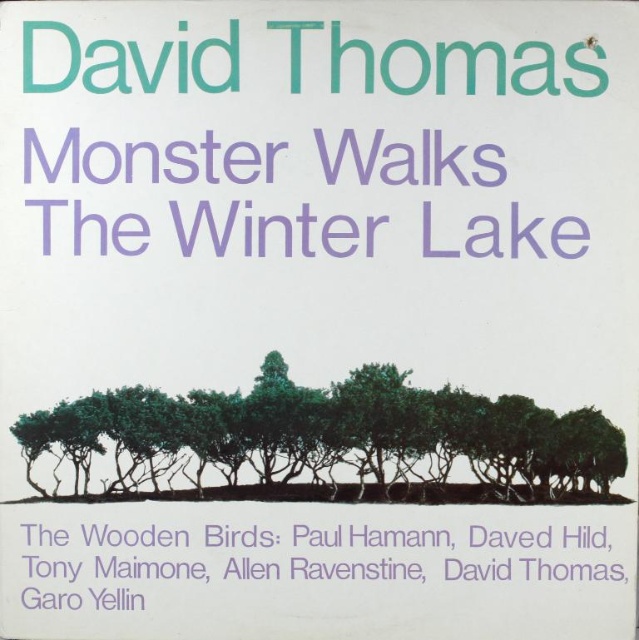
Question: In this image, where is purple paper text at upper center located relative to purple paper at bottom?

Choices:
 (A) right
 (B) left

Answer: (B)

Question: Does green matte trees at center appear over purple paper at bottom?

Choices:
 (A) no
 (B) yes

Answer: (B)

Question: Does green matte trees at center come behind purple paper text at upper center?

Choices:
 (A) no
 (B) yes

Answer: (B)

Question: Which point is farther to the camera?

Choices:
 (A) (88, 540)
 (B) (93, 486)

Answer: (B)

Question: Which object appears closest to the camera in this image?

Choices:
 (A) purple paper at bottom
 (B) green matte trees at center

Answer: (A)

Question: Which is nearer to the purple paper at bottom?

Choices:
 (A) green matte trees at center
 (B) purple paper text at upper center

Answer: (A)